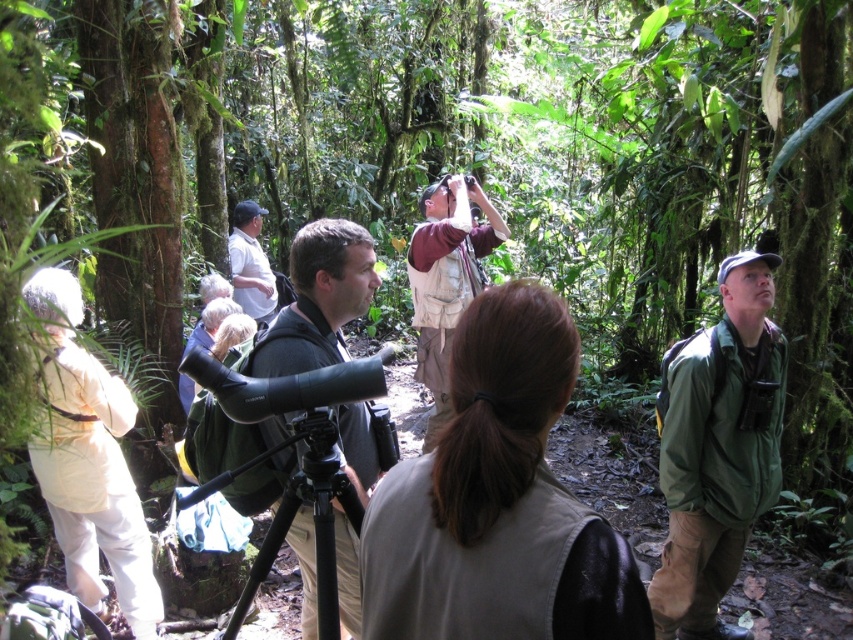
Question: Can you confirm if black matte binoculars at center is wider than white shirt at center?

Choices:
 (A) no
 (B) yes

Answer: (A)

Question: Among these points, which one is nearest to the camera?

Choices:
 (A) (360, 628)
 (B) (256, 300)

Answer: (A)

Question: Which of the following is the closest to the observer?

Choices:
 (A) maroon fabric binoculars at center
 (B) white shirt at center
 (C) green fabric jacket at center

Answer: (C)

Question: Which point appears farthest from the camera in this image?

Choices:
 (A) (454, 280)
 (B) (259, 220)
 (C) (743, 536)

Answer: (B)

Question: Is black matte binoculars at center to the right of maroon fabric binoculars at center from the viewer's perspective?

Choices:
 (A) yes
 (B) no

Answer: (B)

Question: Observing the image, what is the correct spatial positioning of brown fabric vest at center in reference to maroon fabric binoculars at center?

Choices:
 (A) above
 (B) below

Answer: (B)